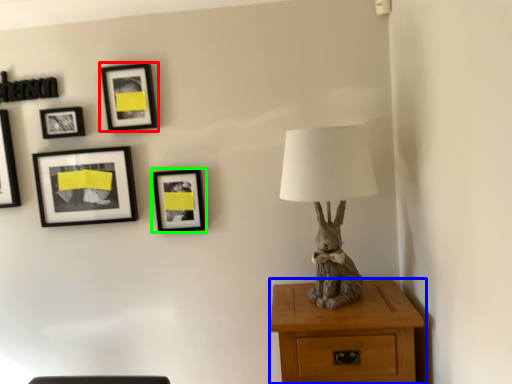
Question: Which object is positioned farthest from picture frame (highlighted by a red box)? Select from nightstand (highlighted by a blue box) and picture frame (highlighted by a green box).

Choices:
 (A) nightstand
 (B) picture frame

Answer: (A)